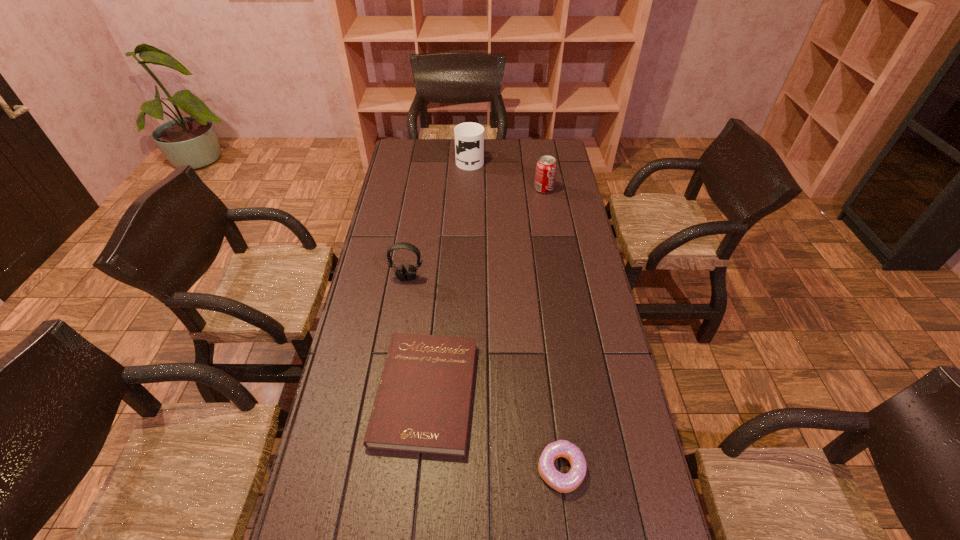
This screenshot has height=540, width=960. What are the coordinates of `the farthest object` in the screenshot? It's located at (469, 137).

Where is `the third farthest object`? This screenshot has height=540, width=960. the third farthest object is located at coordinates (401, 273).

Identify the location of soda. (546, 167).

I want to click on the fourth tallest object, so click(564, 483).

The width and height of the screenshot is (960, 540). I want to click on the shortest object, so click(422, 404).

Image resolution: width=960 pixels, height=540 pixels. In order to click on vacant point located on the handle side of the mug in this screenshot , I will do `click(470, 144)`.

Where is `vacant space positioned on the front-facing side of the headset`? The height and width of the screenshot is (540, 960). vacant space positioned on the front-facing side of the headset is located at coordinates 395,356.

The height and width of the screenshot is (540, 960). Find the location of `free location located on the front of the soda`. free location located on the front of the soda is located at coordinates (549, 220).

This screenshot has height=540, width=960. Find the location of `vacant area located on the right of the second shortest object`. vacant area located on the right of the second shortest object is located at coordinates (621, 470).

At what (x,y) coordinates should I click in order to perform the action: click on vacant area situated on the right of the shortest object. Please return your answer as a coordinate pair (x, y). The image size is (960, 540). Looking at the image, I should click on (530, 393).